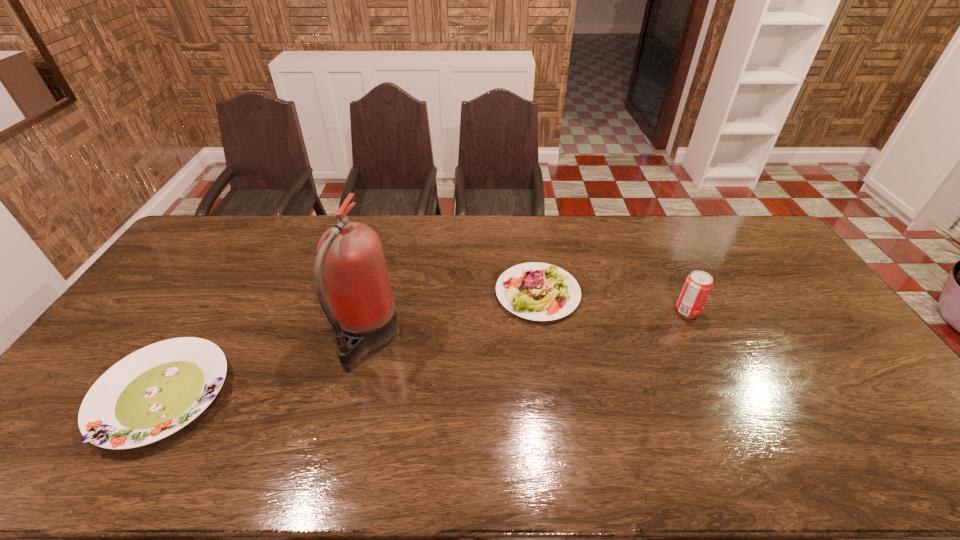
Find the location of `free space between the right salad plate and the soda can`. free space between the right salad plate and the soda can is located at coordinates (612, 302).

Identify the location of vacant area between the second object from right to left and the tallest object. (452, 316).

The width and height of the screenshot is (960, 540). In order to click on vacant point located between the rightmost object and the shorter salad plate in this screenshot , I will do `click(425, 353)`.

Find the location of a particular element. The height and width of the screenshot is (540, 960). free spot between the shorter salad plate and the third object from right to left is located at coordinates (265, 368).

Find the location of a particular element. Image resolution: width=960 pixels, height=540 pixels. empty location between the taller salad plate and the third object from right to left is located at coordinates (452, 316).

The image size is (960, 540). I want to click on vacant region between the farther salad plate and the fire extinguisher, so click(452, 316).

Find the location of a particular element. The height and width of the screenshot is (540, 960). vacant space that's between the shorter salad plate and the second tallest object is located at coordinates (425, 353).

You are a GUI agent. You are given a task and a screenshot of the screen. Output one action in this format:
    pyautogui.click(x=<x>, y=<y>)
    Task: Click on the object that ranks as the second closest to the leftmost object
    
    Given the screenshot: What is the action you would take?
    pyautogui.click(x=536, y=291)

You are a GUI agent. You are given a task and a screenshot of the screen. Output one action in this format:
    pyautogui.click(x=<x>, y=<y>)
    Task: Click on the object that can be found as the third closest to the third shortest object
    
    Given the screenshot: What is the action you would take?
    click(157, 390)

The image size is (960, 540). Identify the location of free space that satisfies the following two spatial constraints: 1. on the back side of the rightmost object; 2. on the left side of the shortest object. pyautogui.click(x=215, y=312).